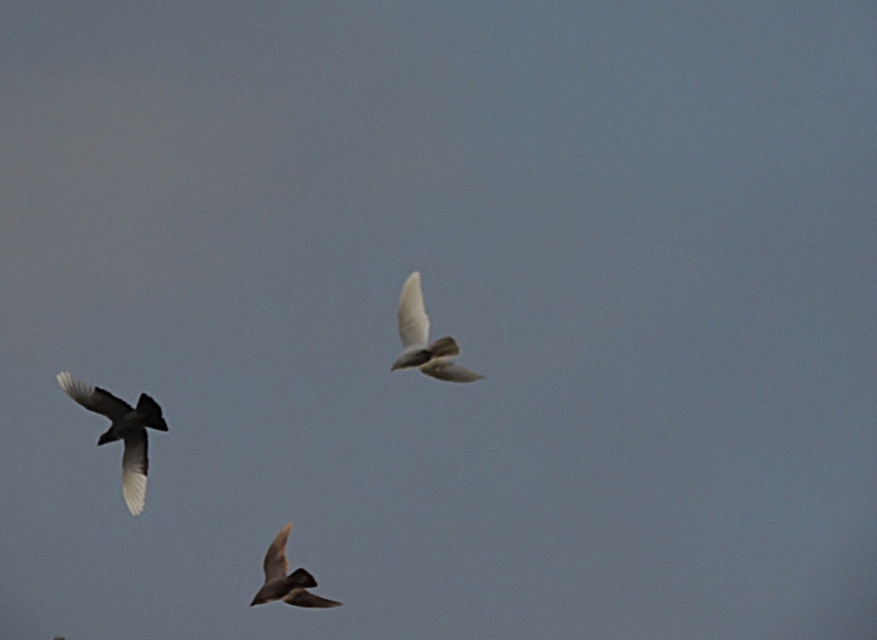
Question: Based on their relative distances, which object is farther from the white feathered bird at center?

Choices:
 (A) brown feathered bird at lower center
 (B) dark brown feathered bird at left

Answer: (B)

Question: Can you confirm if white feathered bird at center is positioned below brown feathered bird at lower center?

Choices:
 (A) no
 (B) yes

Answer: (A)

Question: Is dark brown feathered bird at left wider than white feathered bird at center?

Choices:
 (A) yes
 (B) no

Answer: (B)

Question: Which is farther from the white feathered bird at center?

Choices:
 (A) dark brown feathered bird at left
 (B) brown feathered bird at lower center

Answer: (A)

Question: Which point is closer to the camera taking this photo?

Choices:
 (A) (76, 397)
 (B) (301, 566)
 (C) (408, 288)

Answer: (C)

Question: Is dark brown feathered bird at left above brown feathered bird at lower center?

Choices:
 (A) no
 (B) yes

Answer: (B)